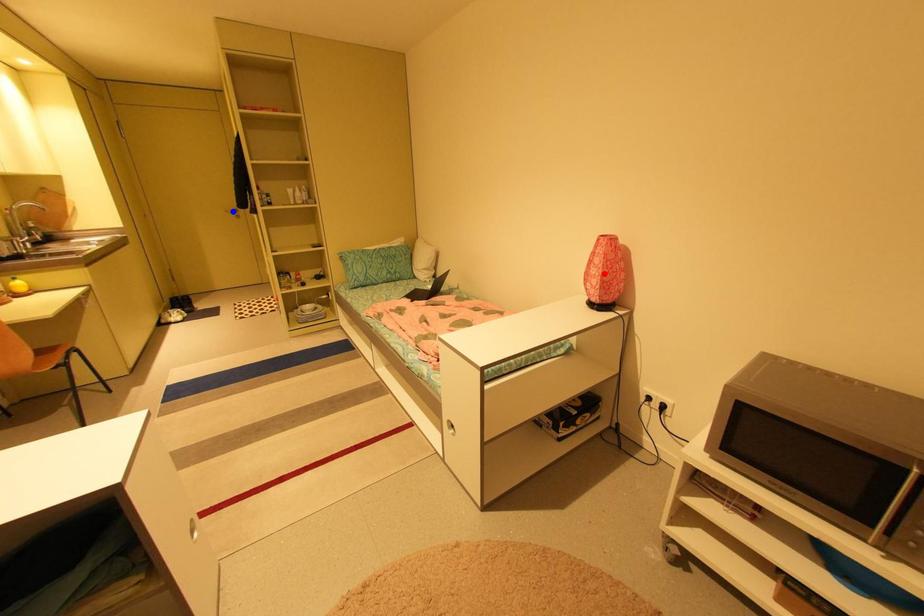
Question: In the image, two points are highlighted. Which point is nearer to the camera? Reply with the corresponding letter.

Choices:
 (A) blue point
 (B) red point

Answer: (B)